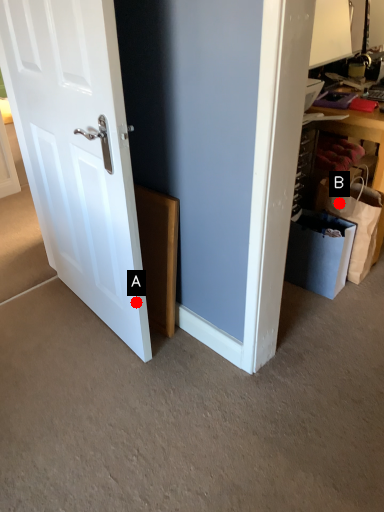
Question: Two points are circled on the image, labeled by A and B beside each circle. Among these points, which one is farthest from the camera?

Choices:
 (A) A is further
 (B) B is further

Answer: (B)